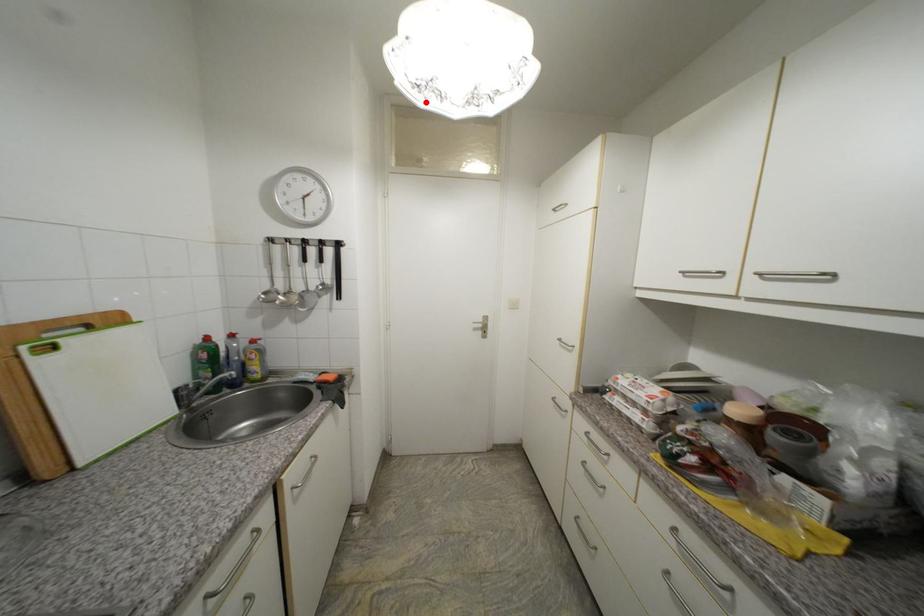
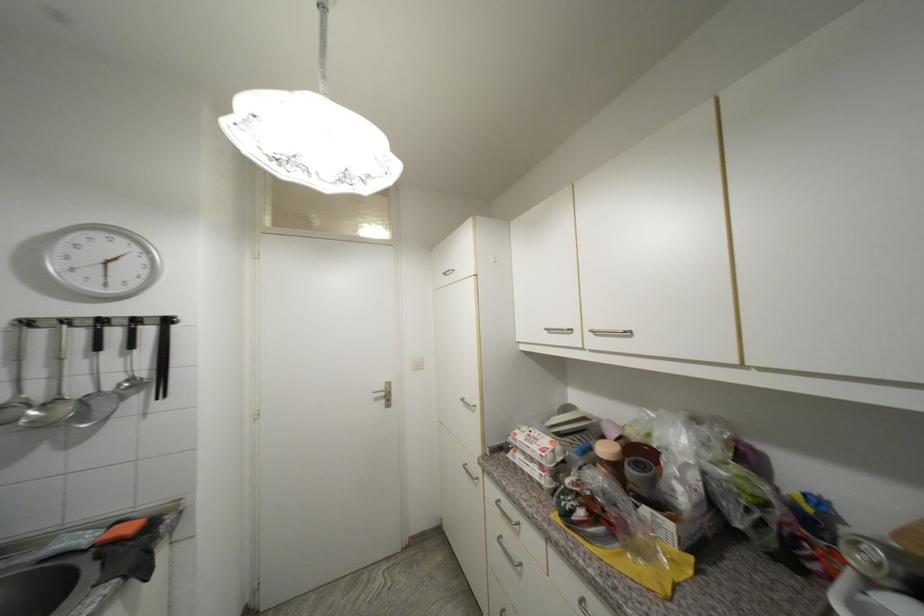
The point at the highlighted location is marked in the first image. Where is the corresponding point in the second image?

(286, 175)